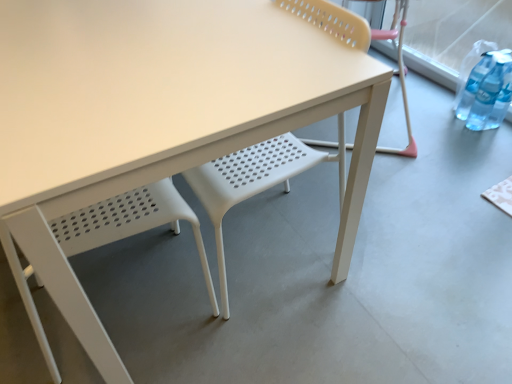
Question: Is matte plastic chair at right, the 1th chair in the right-to-left sequence, bigger or smaller than white plastic chair at lower left, which ranks as the 2th chair in back-to-front order?

Choices:
 (A) small
 (B) big

Answer: (B)

Question: Is matte plastic chair at right, the 1th chair in the right-to-left sequence, inside or outside of white plastic chair at lower left, the 1th chair in the left-to-right sequence?

Choices:
 (A) inside
 (B) outside

Answer: (B)

Question: From the image's perspective, is matte plastic chair at right, acting as the 2th chair starting from the left, located above or below white plastic chair at lower left, which ranks as the 2th chair in back-to-front order?

Choices:
 (A) below
 (B) above

Answer: (B)

Question: In the image, is white plastic chair at lower left, which appears as the first chair when viewed from the front, on the left side or the right side of matte plastic chair at right, which is the second chair in bottom-to-top order?

Choices:
 (A) left
 (B) right

Answer: (A)

Question: Relative to matte plastic chair at right, which appears as the first chair when viewed from the back, is white plastic chair at lower left, which ranks as the 2th chair in back-to-front order, in front or behind?

Choices:
 (A) behind
 (B) front

Answer: (B)

Question: In terms of height, does white plastic chair at lower left, which ranks as the 2th chair in back-to-front order, look taller or shorter compared to matte plastic chair at right, the 1th chair in the right-to-left sequence?

Choices:
 (A) short
 (B) tall

Answer: (B)

Question: Does point 65,256 appear closer or farther from the camera than point 328,144?

Choices:
 (A) farther
 (B) closer

Answer: (B)